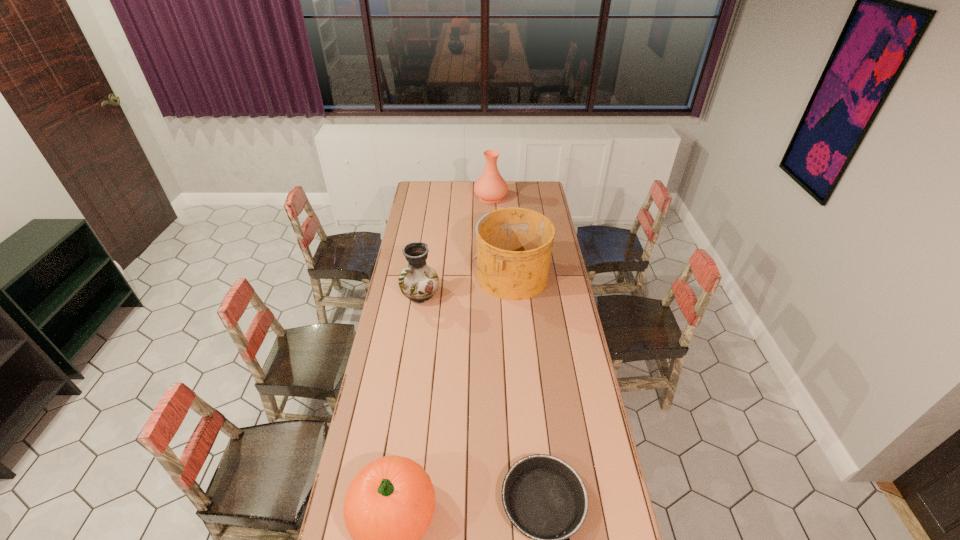
This screenshot has height=540, width=960. I want to click on the farthest object, so click(490, 187).

Identify the location of the right vase. The height and width of the screenshot is (540, 960). pos(490,187).

At what (x,y) coordinates should I click in order to perform the action: click on bucket. Please return your answer as a coordinate pair (x, y). This screenshot has height=540, width=960. Looking at the image, I should click on (514, 245).

Where is `the left vase`? Image resolution: width=960 pixels, height=540 pixels. the left vase is located at coordinates (419, 282).

You are a GUI agent. You are given a task and a screenshot of the screen. Output one action in this format:
    pyautogui.click(x=<x>, y=<y>)
    Task: Click on the free location located 0.240m on the right of the right vase
    The width and height of the screenshot is (960, 540).
    Given the screenshot: What is the action you would take?
    pyautogui.click(x=545, y=197)

You are a GUI agent. You are given a task and a screenshot of the screen. Output one action in this format:
    pyautogui.click(x=<x>, y=<y>)
    Task: Click on the vacant space located 0.370m on the back of the bucket
    This screenshot has width=960, height=540.
    Given the screenshot: What is the action you would take?
    pyautogui.click(x=506, y=214)

Locate an element on the screen. The width and height of the screenshot is (960, 540). vacant area situated 0.320m on the right of the nearer vase is located at coordinates (506, 294).

You are a GUI agent. You are given a task and a screenshot of the screen. Output one action in this format:
    pyautogui.click(x=<x>, y=<y>)
    Task: Click on the object at the far edge
    
    Given the screenshot: What is the action you would take?
    pyautogui.click(x=490, y=187)

The width and height of the screenshot is (960, 540). What are the coordinates of `object that is positioned at the left edge` in the screenshot? It's located at (x=419, y=282).

The height and width of the screenshot is (540, 960). In order to click on object at the right edge in this screenshot , I will do `click(514, 245)`.